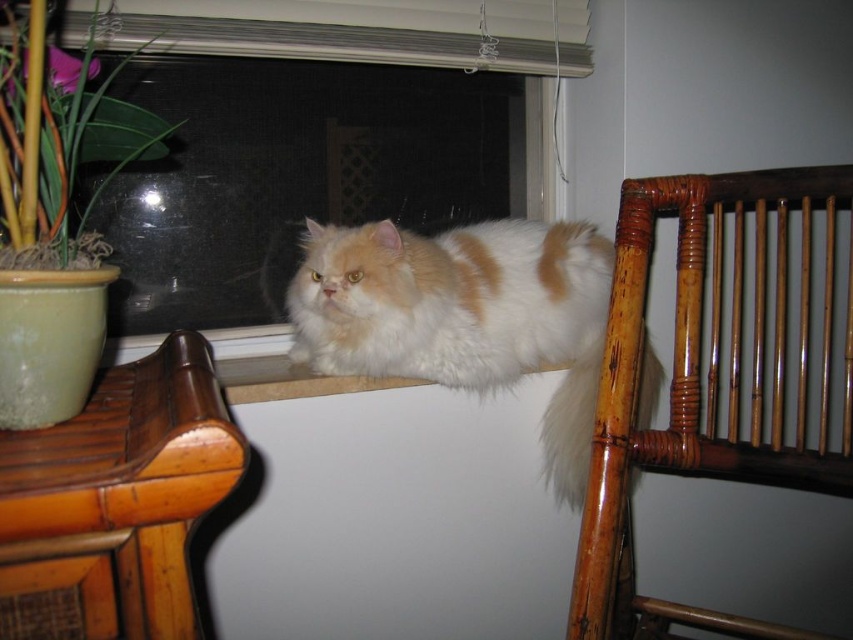
Consider the image. Between transparent glass window at center and bamboo chair at right, which one appears on the left side from the viewer's perspective?

transparent glass window at center is more to the left.

Between transparent glass window at center and bamboo chair at right, which one has less height?

transparent glass window at center is shorter.

Who is more forward, (119, 240) or (689, 218)?

Point (689, 218) is in front.

Image resolution: width=853 pixels, height=640 pixels. I want to click on transparent glass window at center, so click(260, 179).

Does fuzzy white cat at center appear over bamboo chair at right?

Indeed, fuzzy white cat at center is positioned over bamboo chair at right.

Between point (465, 364) and point (770, 445), which one is positioned behind?

Point (465, 364)

Locate an element on the screen. fuzzy white cat at center is located at coordinates (463, 316).

Who is lower down, fuzzy white cat at center or green leafy plant at left?

fuzzy white cat at center

Find the location of a particular element. The width and height of the screenshot is (853, 640). fuzzy white cat at center is located at coordinates (463, 316).